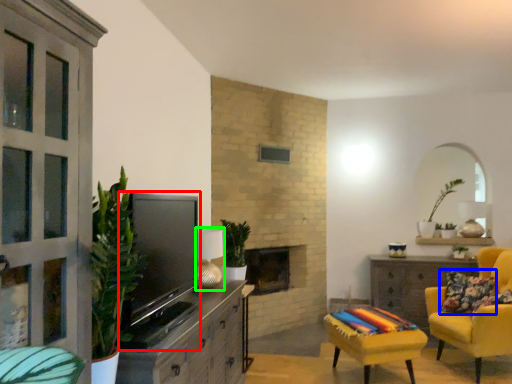
Question: Which object is positioned closest to television (highlighted by a red box)? Select from pillow (highlighted by a blue box) and lamp (highlighted by a green box).

Choices:
 (A) pillow
 (B) lamp

Answer: (B)